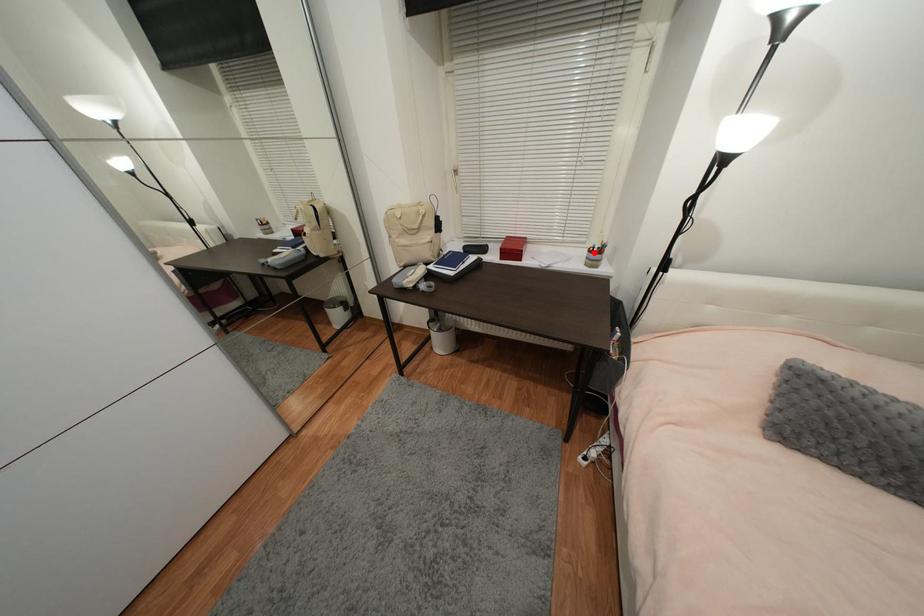
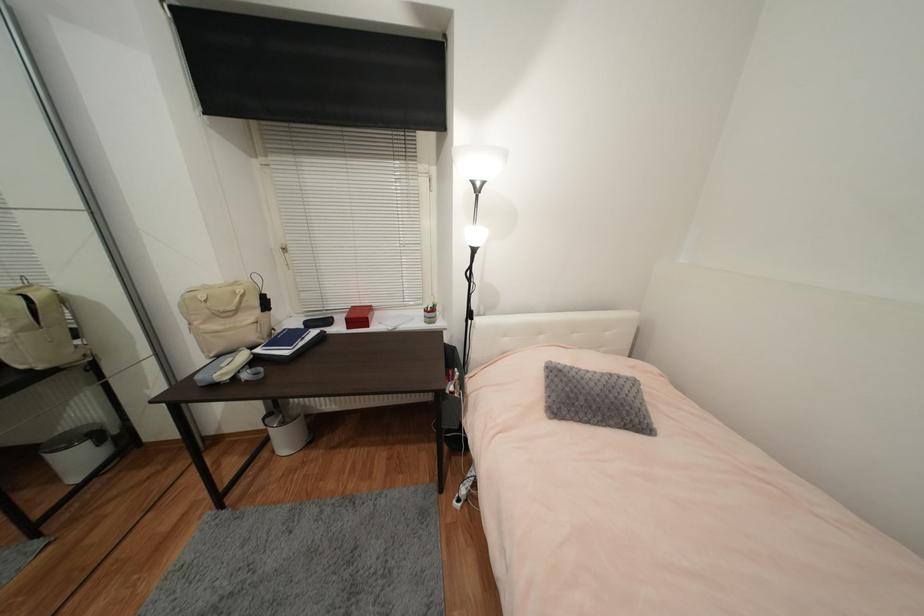
Locate, in the second image, the point that corresponds to the highlighted location in the first image.

(430, 312)